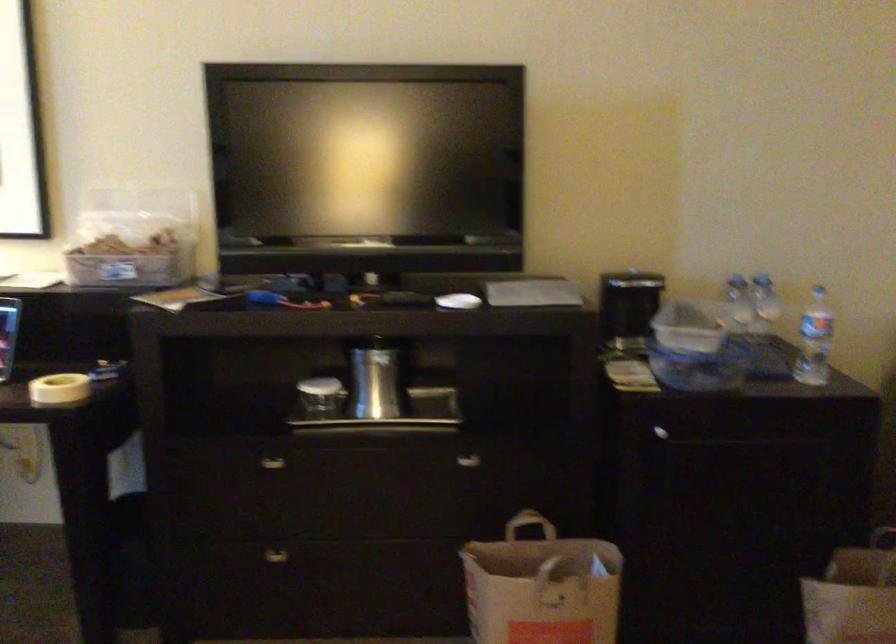
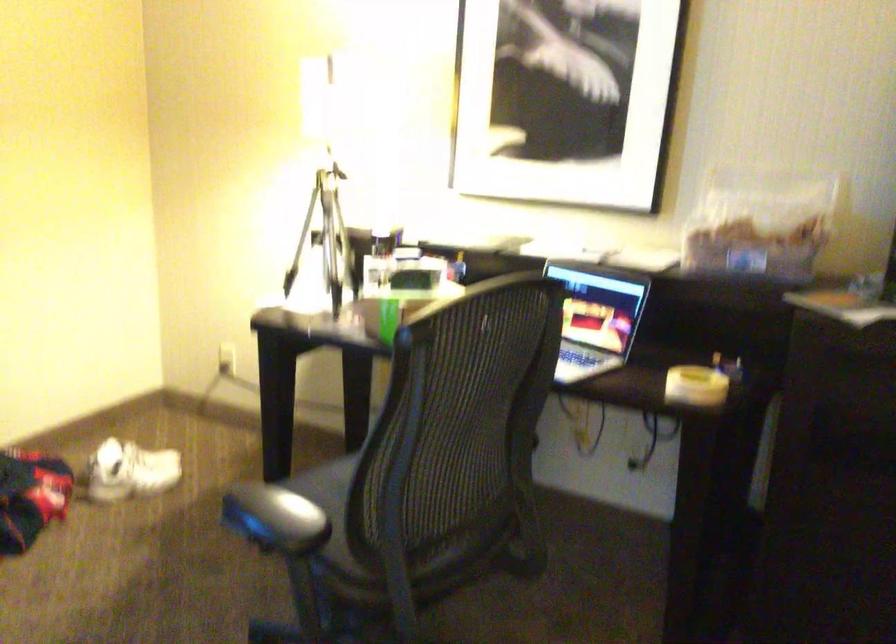
Question: The camera is either moving clockwise (left) or counter-clockwise (right) around the object. The first image is from the beginning of the video and the second image is from the end. Is the camera moving left or right when shooting the video?

Choices:
 (A) Left
 (B) Right

Answer: (B)